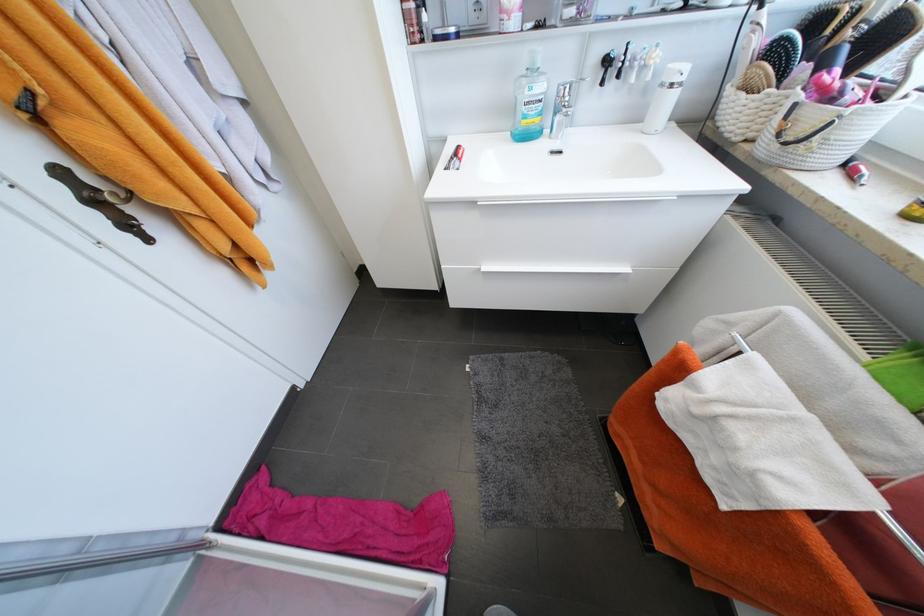
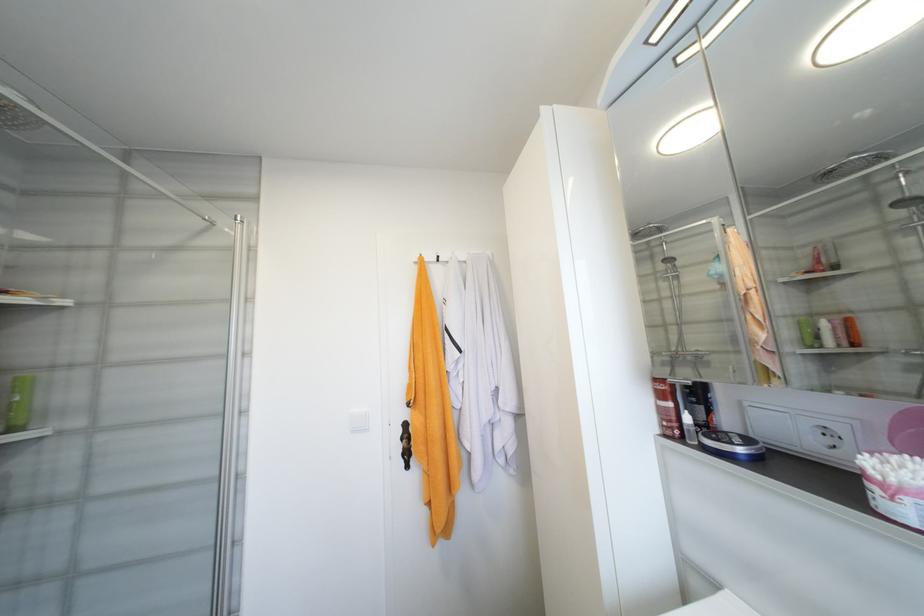
Find the pixel in the second image that matches (458,31) in the first image.

(747, 451)